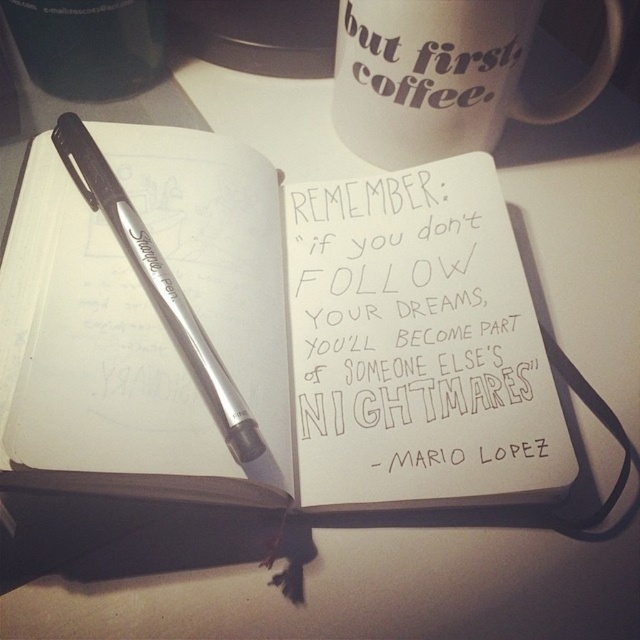
You have a white matte mug at upper center and a metallic silver pen at upper left on your desk. If you want to place both items in a drawer that can only hold items up to the size of the mug, will the pen fit?

The white matte mug at upper center is wider than the metallic silver pen at upper left, so the pen will fit in the drawer since it is smaller in width than the mug.

You are an office worker who needs to reach for either the white matte mug at upper center or the metallic silver pen at upper left. Which object is closer to you?

The metallic silver pen at upper left is behind the white matte mug at upper center, so the white matte mug at upper center is closer to you.